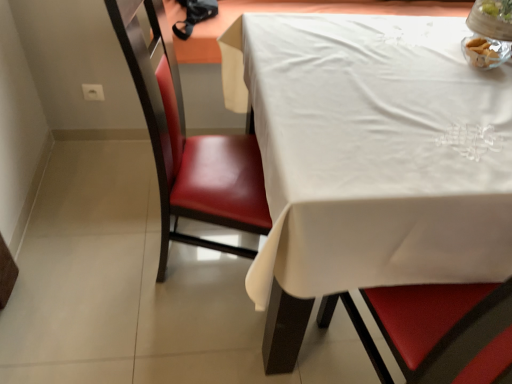
What are the coordinates of `free region under leather at left (from a real-world perspective)` in the screenshot? It's located at (200, 268).